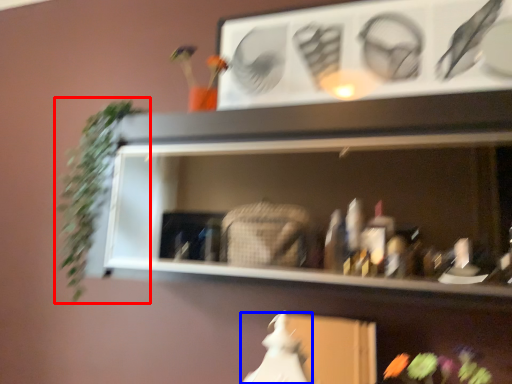
Question: Which object is further to the camera taking this photo, plant (highlighted by a red box) or fancy dress (highlighted by a blue box)?

Choices:
 (A) plant
 (B) fancy dress

Answer: (A)